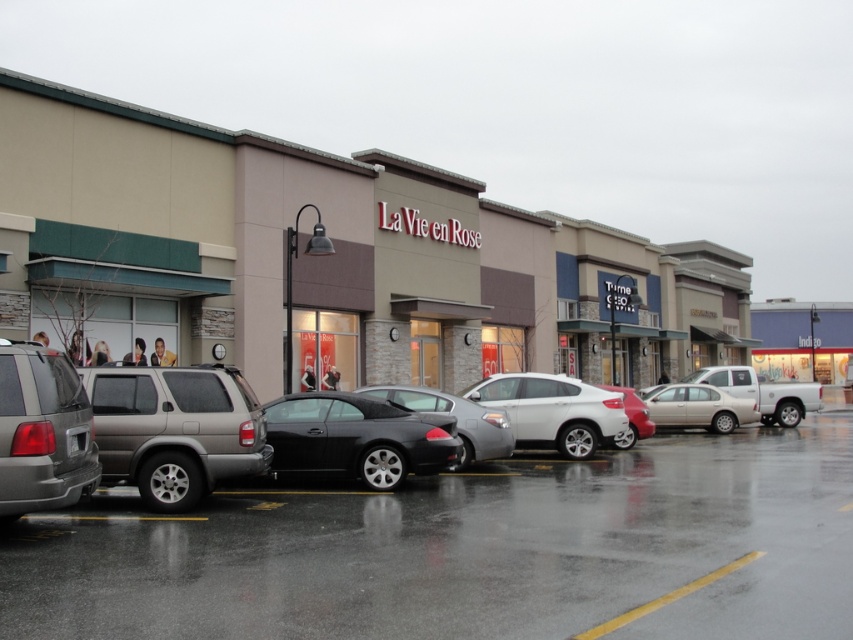
Can you confirm if satin silver sedan at center is wider than satin gold sedan at center?

No.

Who is more forward, [524,436] or [706,392]?

Point [524,436] is more forward.

Is point (518, 417) closer to camera compared to point (701, 417)?

Yes.

The image size is (853, 640). I want to click on satin silver sedan at center, so click(553, 410).

Looking at this image, between shiny silver sedan at center and matte gray minivan at left, which one is positioned lower?

shiny silver sedan at center

Between shiny silver sedan at center and matte gray minivan at left, which one is positioned higher?

matte gray minivan at left

Does point (193, 374) come in front of point (0, 358)?

That is False.

This screenshot has width=853, height=640. Find the location of `shiny silver sedan at center`. shiny silver sedan at center is located at coordinates (44, 433).

Does shiny metallic car at center have a greater width compared to matte gray minivan at left?

Yes.

Who is higher up, shiny metallic car at center or matte gray minivan at left?

matte gray minivan at left is higher up.

At what (x,y) coordinates should I click in order to perform the action: click on shiny metallic car at center. Please return your answer as a coordinate pair (x, y). This screenshot has width=853, height=640. Looking at the image, I should click on (469, 550).

Identify the location of shiny metallic car at center. point(469,550).